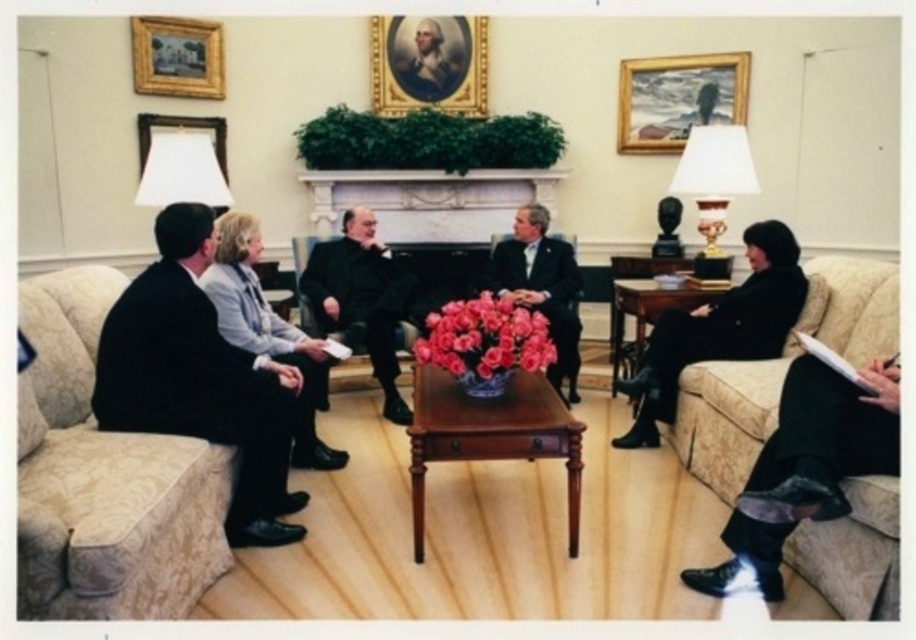
You are standing at the entrance of the room and see the velvet beige couch at right. Can you estimate its location in terms of coordinates?

The velvet beige couch at right is located at coordinates point (791,470).

You are standing at the point labeled point [410,275] in the image. You want to walk to the other side of the room to join a colleague seated across the room. The distance between you and your colleague is 5.24 meters. If you walk at a speed of 1.2 meters per second, how many seconds will it take you to reach them?

The distance between you and your colleague is 5.24 meters. Walking at a speed of 1.2 meters per second, it will take approximately 4.37 seconds to reach them.

You are a photographer setting up for a group photo in the room. You need to ensure that the dark wool suit at center and the wooden coffee table at center are both visible in the frame. Given that the camera has a fixed width, which object should you position closer to the camera to include both in the frame without cropping?

You should position the dark wool suit at center closer to the camera since its width is larger than the wooden coffee table at center. This way, both objects can fit within the frame when the wider object is nearer.